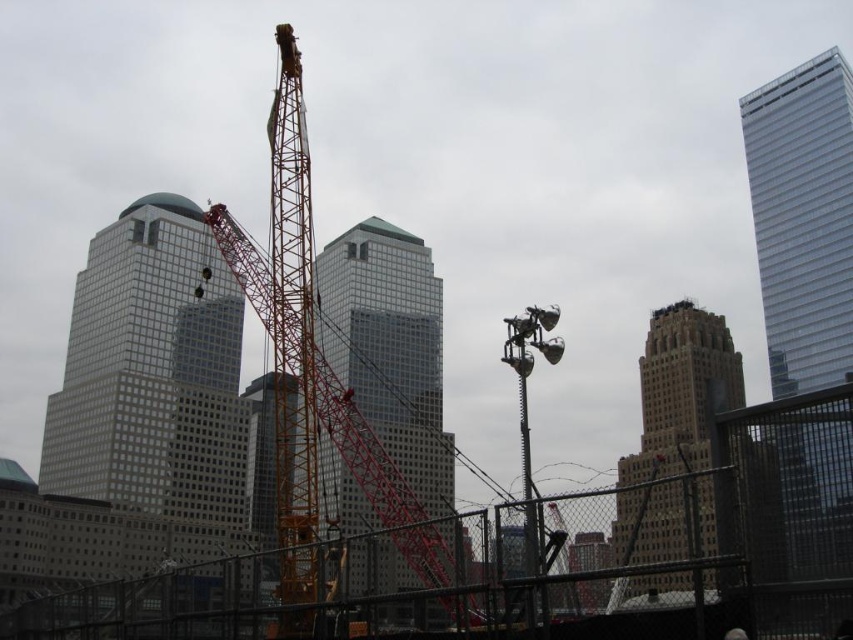
Who is more forward, [621,604] or [210,240]?

Point [621,604] is more forward.

Is black chain-link fence at center positioned in front of matte glass skyscraper at left?

Yes, black chain-link fence at center is in front of matte glass skyscraper at left.

Describe the element at coordinates (564, 564) in the screenshot. I see `black chain-link fence at center` at that location.

This screenshot has width=853, height=640. What are the coordinates of `black chain-link fence at center` in the screenshot? It's located at (564, 564).

Between glassy steel skyscraper at center and yellow metallic crane at center, which one is positioned lower?

glassy steel skyscraper at center is lower down.

Can you confirm if glassy steel skyscraper at center is positioned below yellow metallic crane at center?

Yes, glassy steel skyscraper at center is below yellow metallic crane at center.

At what (x,y) coordinates should I click in order to perform the action: click on glassy steel skyscraper at center. Please return your answer as a coordinate pair (x, y). This screenshot has width=853, height=640. Looking at the image, I should click on (389, 348).

Which is more to the right, black chain-link fence at center or yellow metallic crane at center?

Positioned to the right is black chain-link fence at center.

Can you confirm if black chain-link fence at center is shorter than yellow metallic crane at center?

Yes, black chain-link fence at center is shorter than yellow metallic crane at center.

Between point (708, 506) and point (289, 509), which one is positioned in front?

Point (708, 506) is more forward.

Locate an element on the screen. This screenshot has width=853, height=640. black chain-link fence at center is located at coordinates (564, 564).